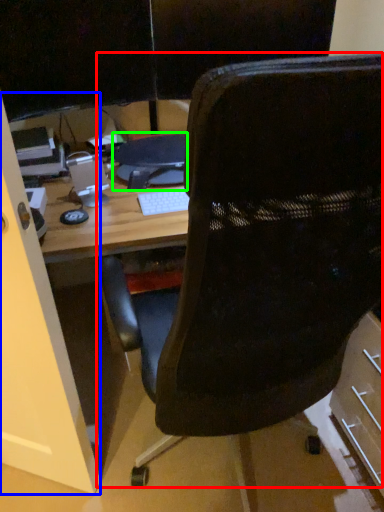
Question: Considering the real-world distances, which object is closest to chair (highlighted by a red box)? glass door (highlighted by a blue box) or computer (highlighted by a green box).

Choices:
 (A) glass door
 (B) computer

Answer: (A)